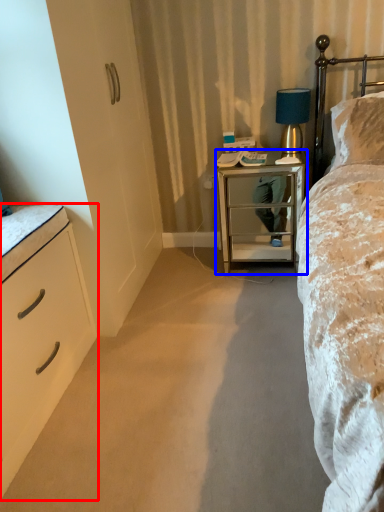
Question: Which point is further to the camera, chest of drawers (highlighted by a red box) or nightstand (highlighted by a blue box)?

Choices:
 (A) chest of drawers
 (B) nightstand

Answer: (B)